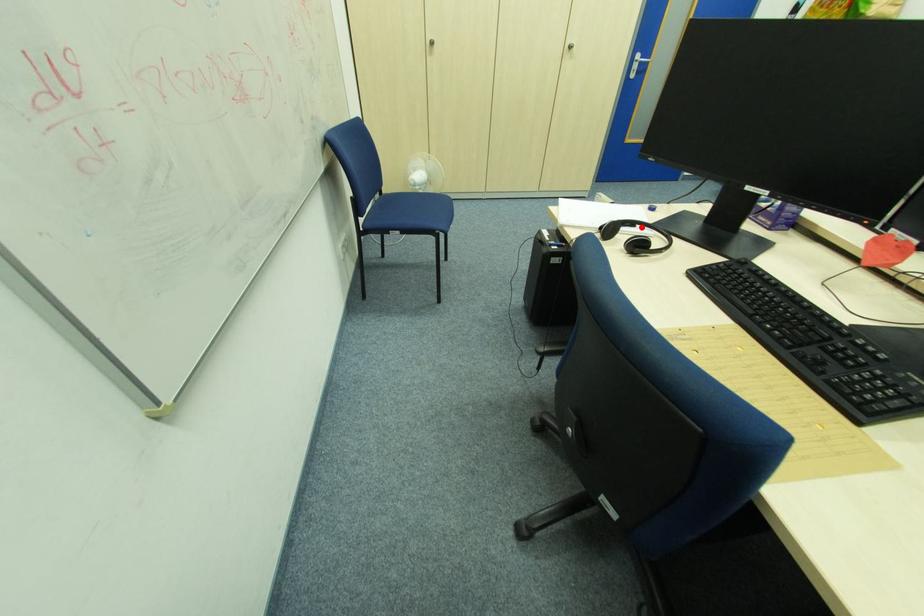
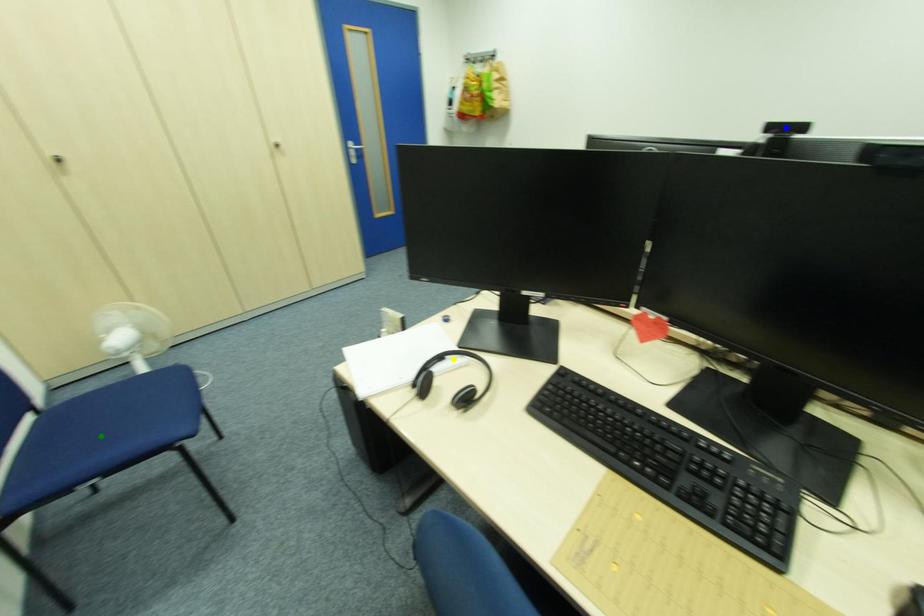
Question: I am providing you with two images of the same scene from different viewpoints. A red point is marked on the first image. You are given multiple points on the second image. In image 2, which mark is for the same physical point as the one in image 1?

Choices:
 (A) green point
 (B) yellow point
 (C) blue point

Answer: (B)